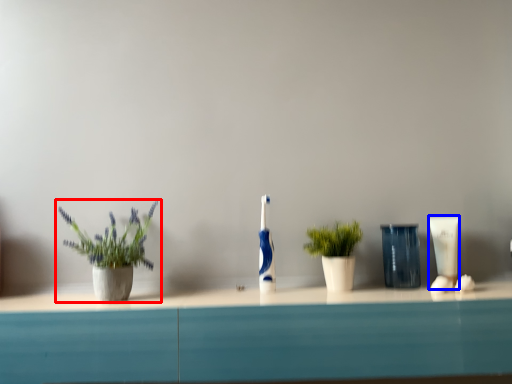
Question: Which point is closer to the camera, houseplant (highlighted by a red box) or toiletry (highlighted by a blue box)?

Choices:
 (A) houseplant
 (B) toiletry

Answer: (A)